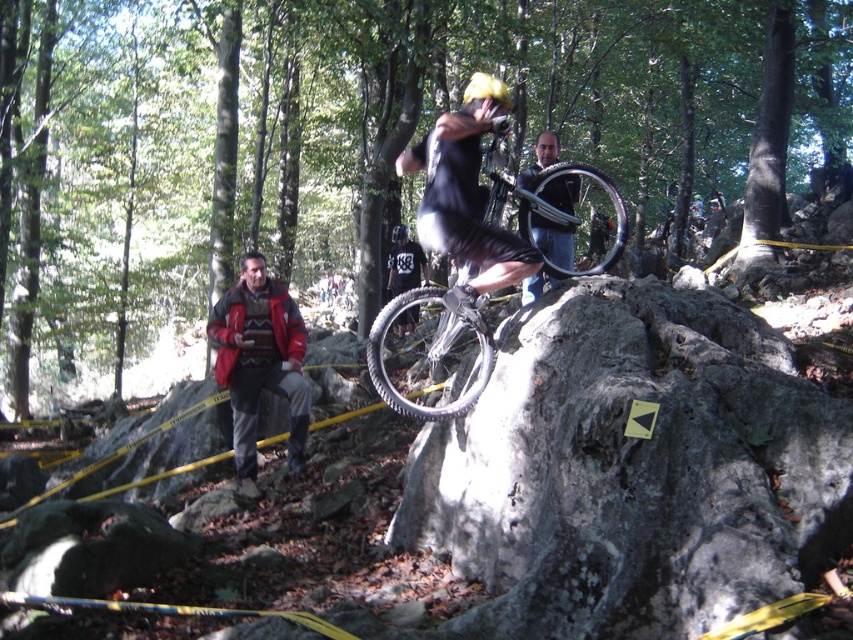
Who is higher up, red jacket at left or dark gray jersey at center?

Positioned higher is dark gray jersey at center.

Is red jacket at left thinner than dark gray jersey at center?

Incorrect, red jacket at left's width is not less than dark gray jersey at center's.

Is point (253, 380) positioned behind point (397, 326)?

No, it is not.

Find the location of a particular element. Image resolution: width=853 pixels, height=640 pixels. red jacket at left is located at coordinates (260, 358).

Which of these two, black matte shirt at center or yellow matte bicycle helmet at upper center, stands shorter?

With less height is yellow matte bicycle helmet at upper center.

Identify the location of black matte shirt at center. click(x=466, y=193).

Can you confirm if silver metallic bicycle at center is positioned to the right of red jacket at left?

Indeed, silver metallic bicycle at center is positioned on the right side of red jacket at left.

Who is more distant from viewer, (x=601, y=259) or (x=244, y=346)?

The point (x=601, y=259) is more distant.

I want to click on silver metallic bicycle at center, so click(x=428, y=356).